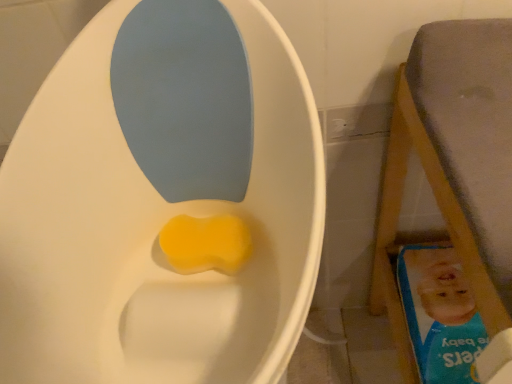
What do you see at coordinates (206, 243) in the screenshot? This screenshot has height=384, width=512. I see `yellow sponge at lower center` at bounding box center [206, 243].

Image resolution: width=512 pixels, height=384 pixels. I want to click on yellow sponge at lower center, so click(206, 243).

Image resolution: width=512 pixels, height=384 pixels. Identify the location of yellow sponge at lower center. (206, 243).